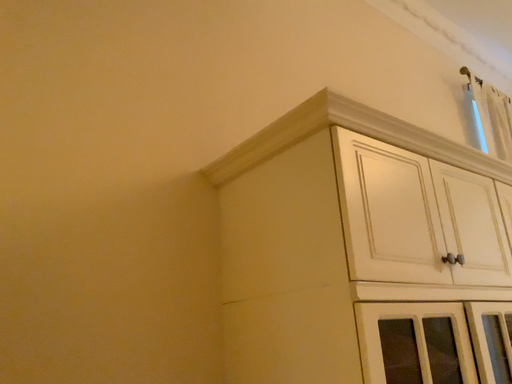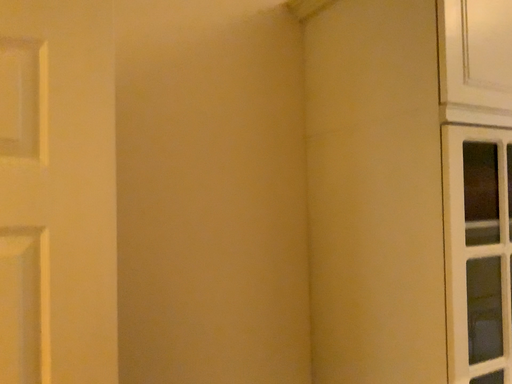
Question: How did the camera likely rotate when shooting the video?

Choices:
 (A) rotated left
 (B) rotated right

Answer: (A)